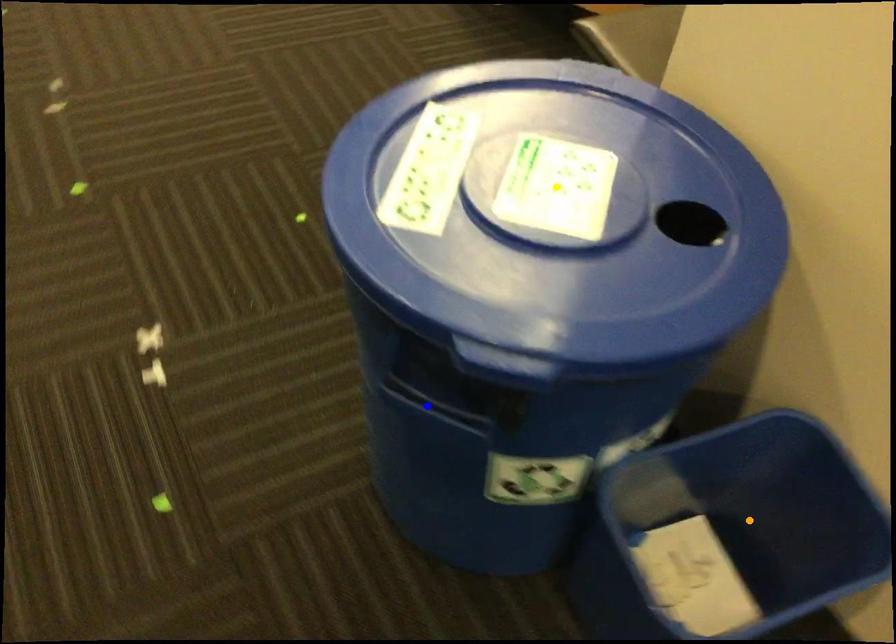
Order these from nearest to farthest:
1. blue point
2. yellow point
3. orange point

blue point
yellow point
orange point